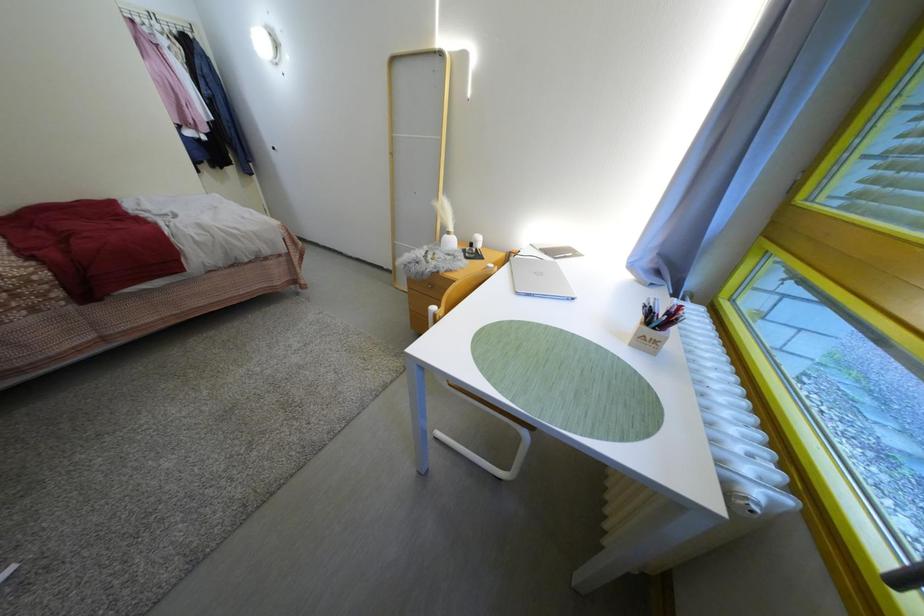
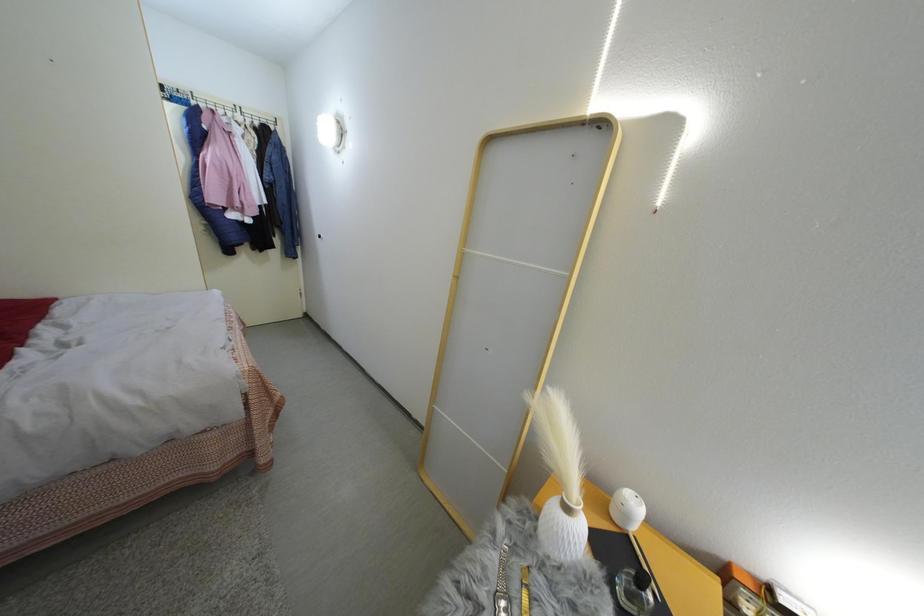
Question: Which direction would the cameraman need to move to produce the second image? Reply with the corresponding letter.

Choices:
 (A) Left
 (B) Right
 (C) Forward
 (D) Backward

Answer: (C)